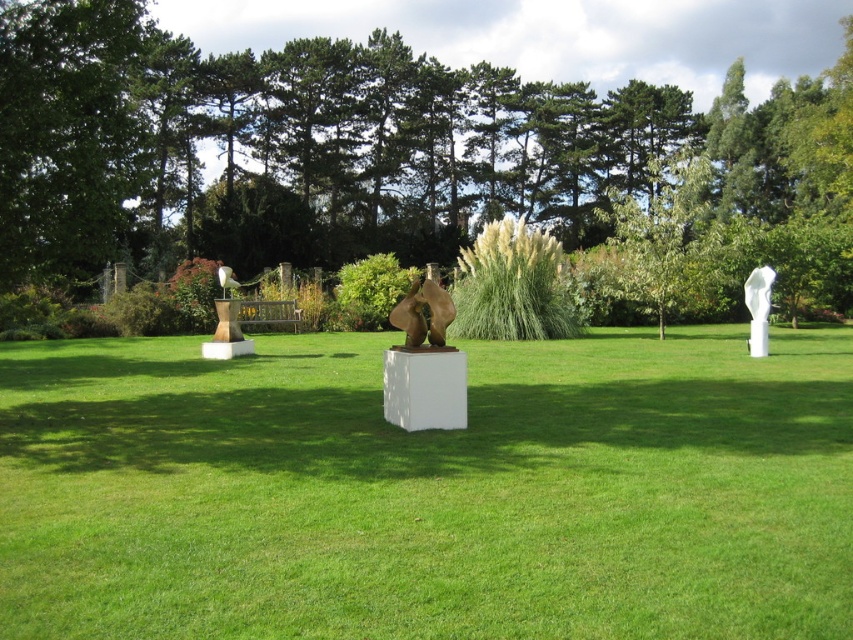
In the scene shown: You are standing in the garden and want to take a photo of both the point at (415, 324) and the point at (766, 307). Since you can only focus on one point at a time, which point should you focus on first to ensure the other is still in the background?

You should focus on point (415, 324) first because it is in front of point (766, 307), so the latter will naturally appear in the background when the former is in focus.

You are standing in the garden and want to take a photo of the bronze sculpture at center without the green leafy tree at center blocking it. How should you position yourself?

Move behind the green leafy tree at center so that it is between you and the bronze sculpture at center, but since the tree is in front, you can move to the side or behind the tree to get an unobstructed view of the bronze sculpture at center.